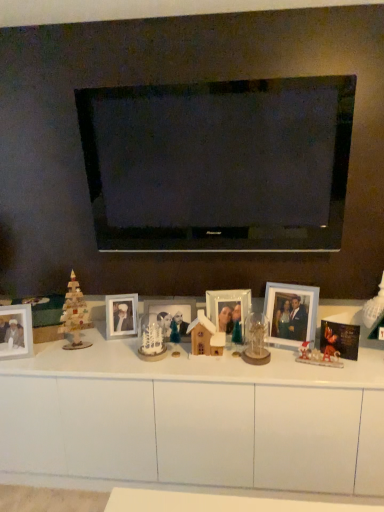
I want to click on unoccupied space behind metallic gold ornament at center-right, which is the first toy from right to left, so click(303, 352).